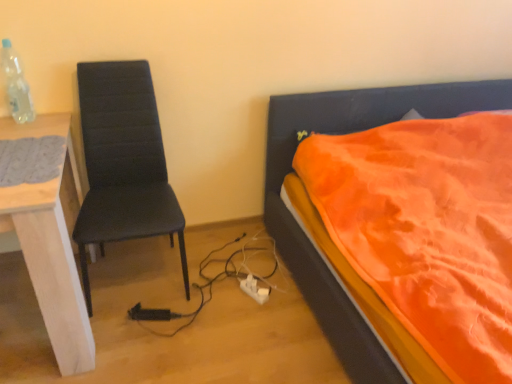
This screenshot has height=384, width=512. Find the location of `free spot behind white plastic power plugs and sockets at lower center`. free spot behind white plastic power plugs and sockets at lower center is located at coordinates (256, 268).